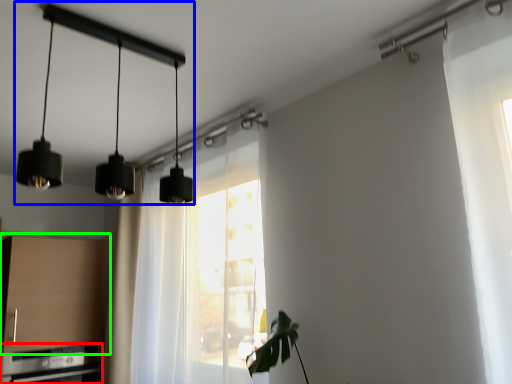
Question: Which object is the closest to the appliance (highlighted by a red box)? Choose among these: lamp (highlighted by a blue box) or cabinetry (highlighted by a green box).

Choices:
 (A) lamp
 (B) cabinetry

Answer: (B)